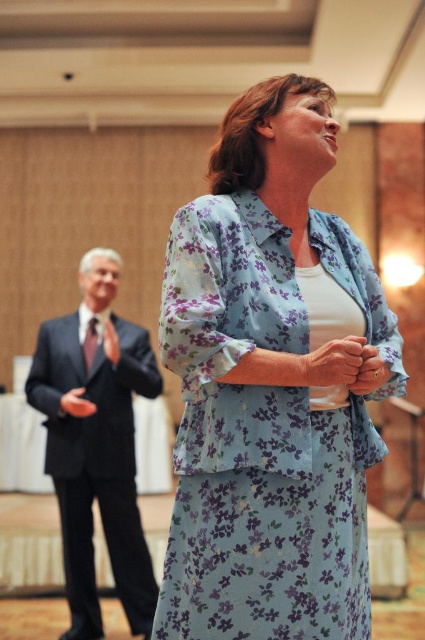
Question: Can you confirm if floral-patterned fabric dress at center is thinner than black suit at left?

Choices:
 (A) no
 (B) yes

Answer: (B)

Question: Which point is closer to the camera?

Choices:
 (A) (280, 522)
 (B) (65, 522)

Answer: (A)

Question: Can you confirm if floral-patterned fabric dress at center is positioned to the left of black suit at left?

Choices:
 (A) yes
 (B) no

Answer: (B)

Question: From the image, what is the correct spatial relationship of floral-patterned fabric dress at center in relation to black suit at left?

Choices:
 (A) right
 (B) left

Answer: (A)